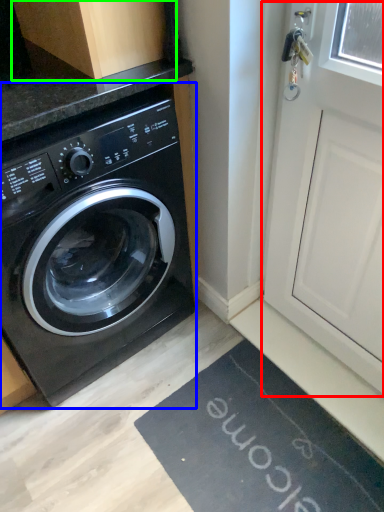
Question: Which is nearer to the screen door (highlighted by a red box)? washing machine (highlighted by a blue box) or cabinetry (highlighted by a green box).

Choices:
 (A) washing machine
 (B) cabinetry

Answer: (A)